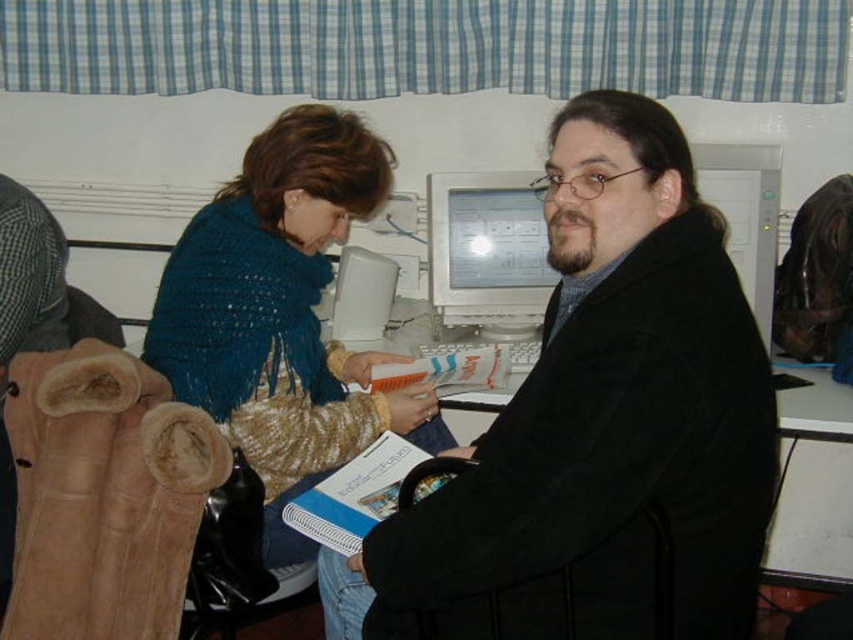
From the picture: You are setting up a photo shoot in this office scene. You need to place a large prop that requires more space between the knitted blue scarf at left and the white plastic computer monitor at center. Which object should you place the prop next to?

The knitted blue scarf at left is bigger than the white plastic computer monitor at center, so you should place the large prop next to the knitted blue scarf at left because it has more space available.

From the picture: You are a delivery person who needs to place a small package on the desk. The package must be placed exactly where the black matte coat at center is located. According to the coordinates given, where should you place the package on the desk?

The black matte coat at center is located at coordinates point [599,428], so you should place the package at that exact point on the desk.

In the scene shown: You are a photographer taking a picture of the scene. You need to ensure that both the knitted blue scarf at left and the white plastic computer monitor at center are clearly visible in the frame. Based on their positions, which object should you adjust your camera angle to focus on first to include both in the shot?

Since the knitted blue scarf at left is to the left of the white plastic computer monitor at center, you should adjust your camera angle to focus on the knitted blue scarf at left first, then pan towards the center to include the white plastic computer monitor at center in the frame.